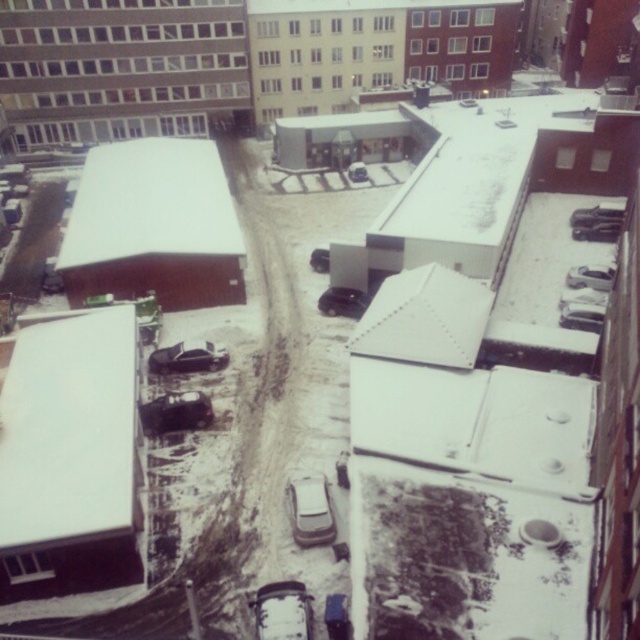
Question: Which of the following is the closest to the observer?

Choices:
 (A) shiny silver sedan at center
 (B) shiny silver car at lower left

Answer: (B)

Question: Which of the following is the farthest from the observer?

Choices:
 (A) satin black car at center
 (B) white matte car at lower center
 (C) shiny silver sedan at center
 (D) shiny silver car at lower left

Answer: (C)

Question: Does white matte car at lower center appear over shiny black car at center?

Choices:
 (A) no
 (B) yes

Answer: (A)

Question: Based on their relative distances, which object is farther from the shiny black car at center?

Choices:
 (A) white matte car at center
 (B) matte black car at center
 (C) silver metallic car at center

Answer: (B)

Question: Is shiny silver car at lower left thinner than matte black car at center?

Choices:
 (A) no
 (B) yes

Answer: (B)

Question: Is shiny silver sedan at center above matte black car at center?

Choices:
 (A) yes
 (B) no

Answer: (B)